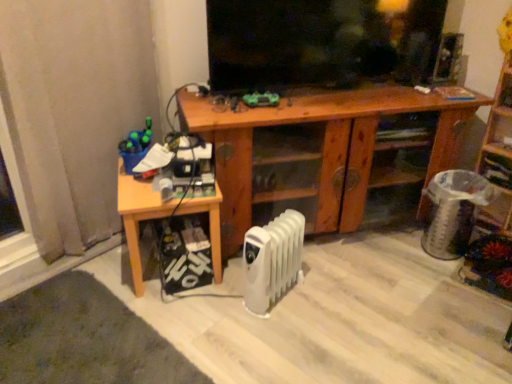
Find the location of a particular element. The height and width of the screenshot is (384, 512). free location in front of green matte toy at center, placed as the second toy when sorted from left to right is located at coordinates (257, 113).